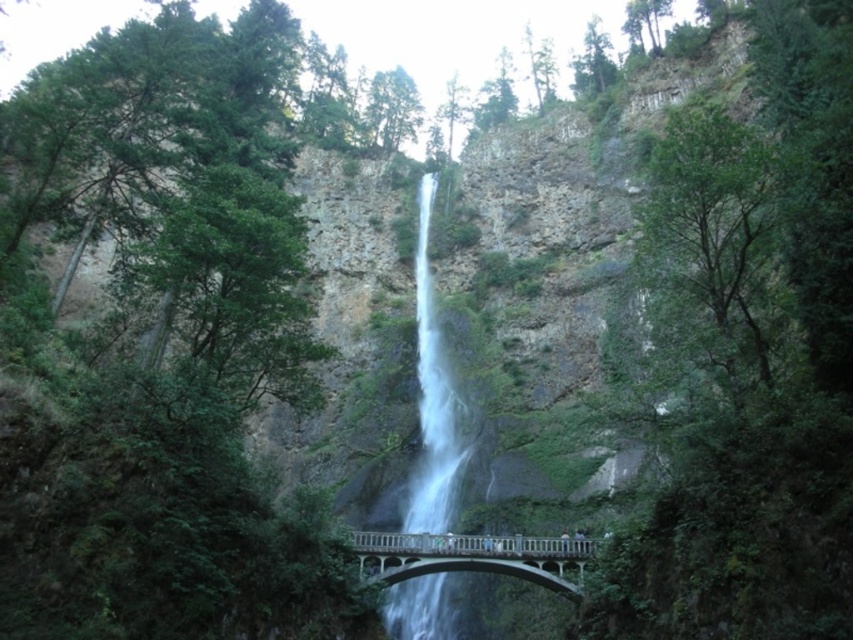
Is white frothy water at center above white concrete bridge at center?

Correct, white frothy water at center is located above white concrete bridge at center.

Does white frothy water at center come in front of white concrete bridge at center?

No, it is not.

Is point (440, 493) more distant than point (379, 561)?

Yes, point (440, 493) is behind point (379, 561).

Find the location of `white frothy water at center`. white frothy water at center is located at coordinates (432, 400).